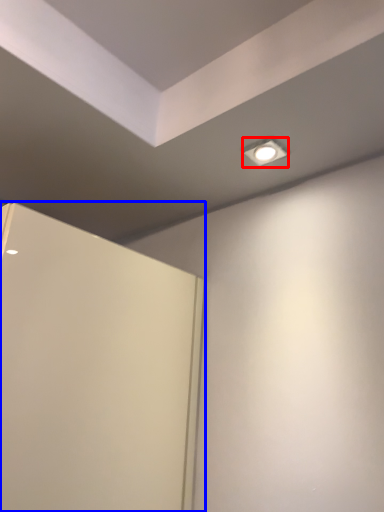
Question: Which point is closer to the camera, lighting (highlighted by a red box) or door (highlighted by a blue box)?

Choices:
 (A) lighting
 (B) door

Answer: (B)